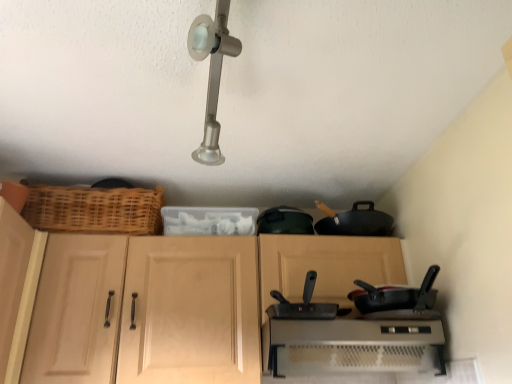
Question: Considering the relative sizes of light wood cabinet at left and metallic silver toaster at lower center in the image provided, is light wood cabinet at left taller than metallic silver toaster at lower center?

Choices:
 (A) no
 (B) yes

Answer: (B)

Question: Can you confirm if light wood cabinet at left is positioned to the right of metallic silver toaster at lower center?

Choices:
 (A) no
 (B) yes

Answer: (A)

Question: Can you confirm if light wood cabinet at left is smaller than metallic silver toaster at lower center?

Choices:
 (A) no
 (B) yes

Answer: (B)

Question: Can you confirm if light wood cabinet at left is thinner than metallic silver toaster at lower center?

Choices:
 (A) no
 (B) yes

Answer: (B)

Question: From the image's perspective, is light wood cabinet at left below metallic silver toaster at lower center?

Choices:
 (A) yes
 (B) no

Answer: (B)

Question: Is light wood cabinet at left positioned with its back to metallic silver toaster at lower center?

Choices:
 (A) no
 (B) yes

Answer: (A)

Question: Is black matte frying pan at right a part of black matte wok at center?

Choices:
 (A) yes
 (B) no

Answer: (B)

Question: From a real-world perspective, is black matte wok at center positioned over black matte frying pan at right based on gravity?

Choices:
 (A) yes
 (B) no

Answer: (B)

Question: Considering the relative sizes of black matte wok at center and black matte frying pan at right in the image provided, is black matte wok at center thinner than black matte frying pan at right?

Choices:
 (A) no
 (B) yes

Answer: (A)

Question: Is black matte wok at center next to black matte frying pan at right and touching it?

Choices:
 (A) no
 (B) yes

Answer: (A)

Question: From the image's perspective, does black matte wok at center appear lower than black matte frying pan at right?

Choices:
 (A) yes
 (B) no

Answer: (B)

Question: Considering the relative sizes of black matte wok at center and black matte frying pan at right in the image provided, is black matte wok at center taller than black matte frying pan at right?

Choices:
 (A) no
 (B) yes

Answer: (A)

Question: Does black matte frying pan at right appear on the left side of light wood cabinet at left?

Choices:
 (A) yes
 (B) no

Answer: (B)